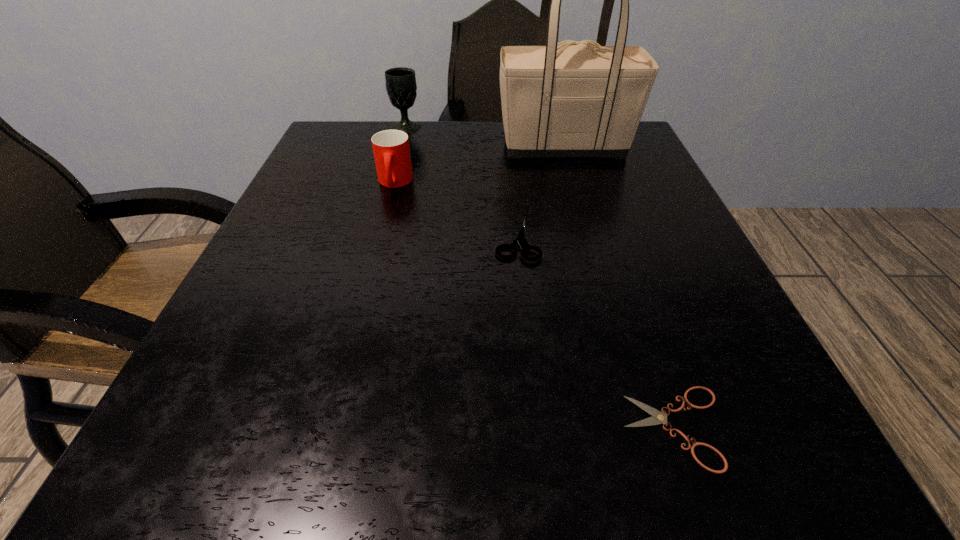
You are a GUI agent. You are given a task and a screenshot of the screen. Output one action in this format:
    pyautogui.click(x=<x>, y=<y>)
    Task: Click on the shopping bag
    The image size is (960, 540).
    Given the screenshot: What is the action you would take?
    pyautogui.click(x=579, y=99)

Find the location of a particular element. The image size is (960, 540). the fourth shortest object is located at coordinates (401, 87).

Locate an element on the screen. The height and width of the screenshot is (540, 960). the third tallest object is located at coordinates (391, 149).

The width and height of the screenshot is (960, 540). Identify the location of the third nearest object. (391, 149).

In order to click on the second nearest object in this screenshot , I will do `click(521, 241)`.

This screenshot has height=540, width=960. Find the location of `the farther shears`. the farther shears is located at coordinates (521, 241).

Identify the location of the nearer shears. This screenshot has height=540, width=960. (658, 417).

This screenshot has width=960, height=540. What are the coordinates of `the shortest object` in the screenshot? It's located at (658, 417).

You are a GUI agent. You are given a task and a screenshot of the screen. Output one action in this format:
    pyautogui.click(x=<x>, y=<y>)
    Task: Click on the vacant point located with handles facing forward on the shopping bag
    This screenshot has height=540, width=960.
    Given the screenshot: What is the action you would take?
    pyautogui.click(x=362, y=146)

What are the coordinates of `free space located 0.340m with handles facing forward on the shopping bag` in the screenshot? It's located at point(348,146).